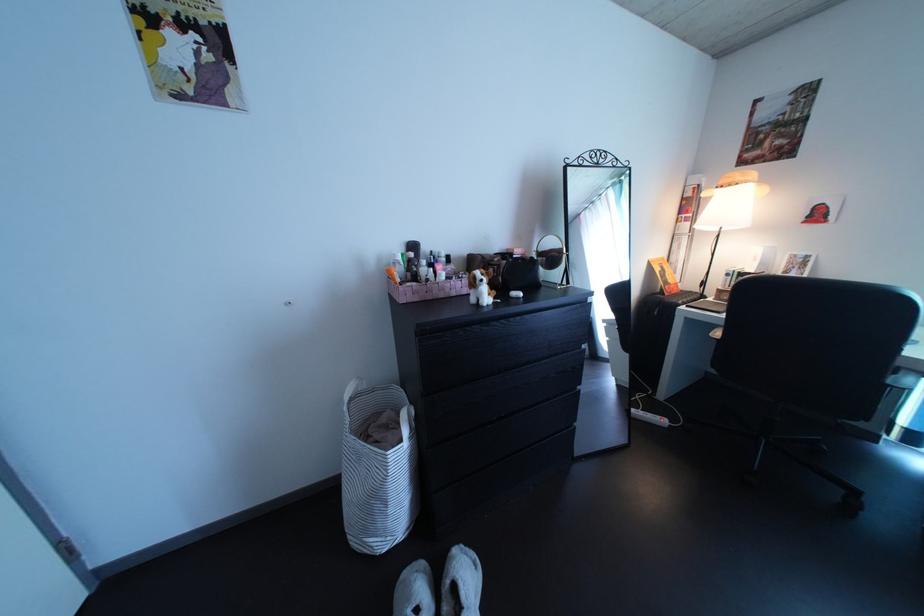
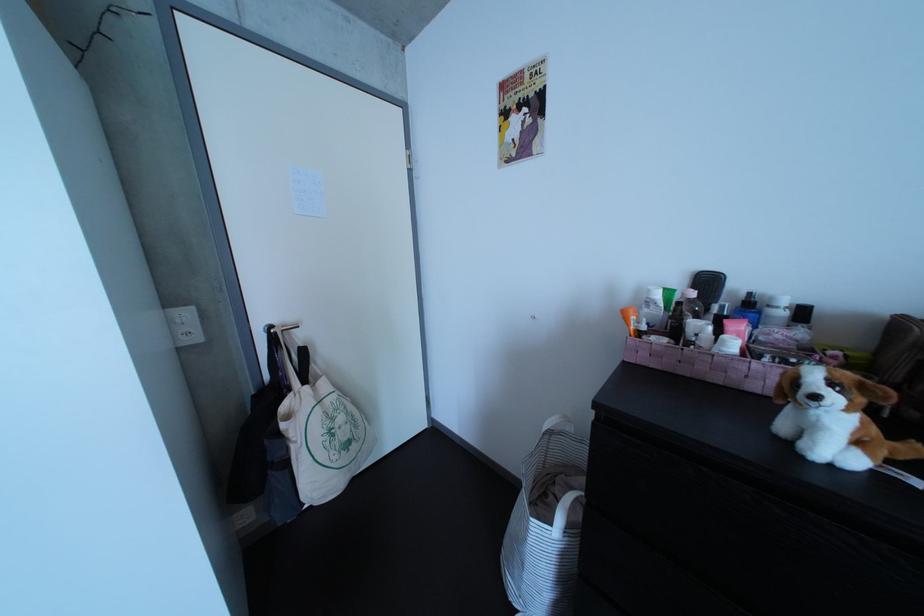
Locate, in the second image, the point that corresponds to (x=489, y=286) in the first image.

(809, 389)